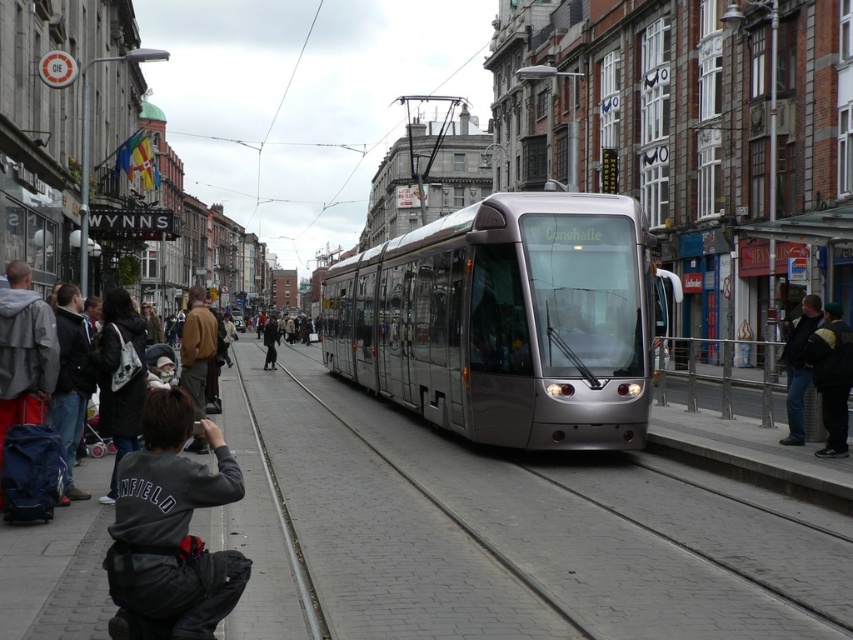
From the picture: Between metal/smooth train track at center and dark gray sweatshirt at lower left, which one has more height?

dark gray sweatshirt at lower left

Is metal/smooth train track at center thinner than dark gray sweatshirt at lower left?

In fact, metal/smooth train track at center might be wider than dark gray sweatshirt at lower left.

The height and width of the screenshot is (640, 853). Identify the location of metal/smooth train track at center. (532, 532).

Which is below, dark gray sweatshirt at lower left or dark gray jacket at left?

dark gray sweatshirt at lower left is below.

Can you confirm if dark gray sweatshirt at lower left is smaller than dark gray jacket at left?

Yes, dark gray sweatshirt at lower left is smaller than dark gray jacket at left.

Is point (213, 484) closer to camera compared to point (68, 396)?

Yes, point (213, 484) is in front of point (68, 396).

Find the location of `dark gray sweatshirt at lower left`. dark gray sweatshirt at lower left is located at coordinates (171, 529).

Does dark gray sweatshirt at lower left have a lesser height compared to matte gray jacket at left?

Indeed, dark gray sweatshirt at lower left has a lesser height compared to matte gray jacket at left.

Between dark gray sweatshirt at lower left and matte gray jacket at left, which one has more height?

With more height is matte gray jacket at left.

Between point (202, 600) and point (25, 262), which one is positioned in front?

Point (202, 600) is in front.

Identify the location of dark gray sweatshirt at lower left. (171, 529).